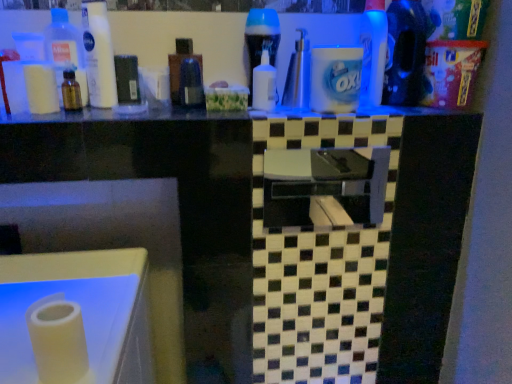
What are the coordinates of `free space to the right of white matte lotion at upper left, acting as the first cleaning product starting from the left` in the screenshot? It's located at coord(181,111).